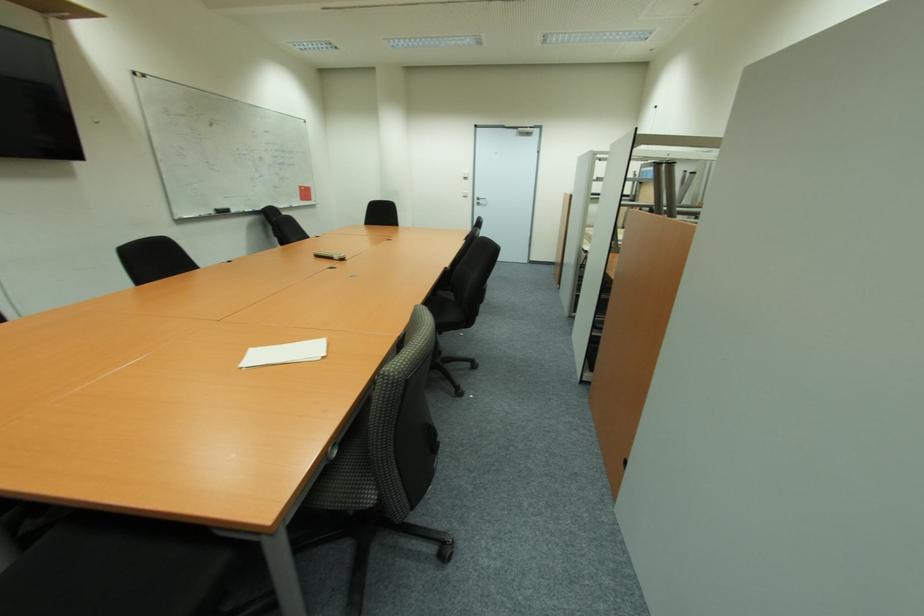
The width and height of the screenshot is (924, 616). Find the location of `folded white papers`. folded white papers is located at coordinates (285, 353).